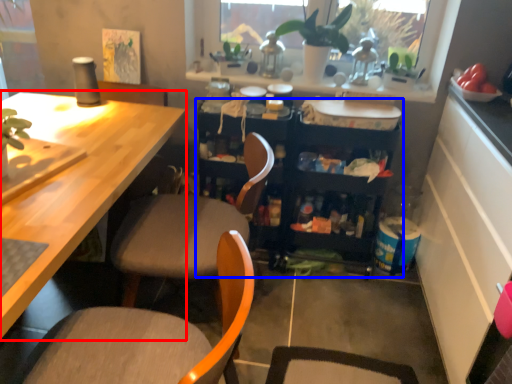
Question: Which object is further to the camera taking this photo, desk (highlighted by a red box) or cabinetry (highlighted by a blue box)?

Choices:
 (A) desk
 (B) cabinetry

Answer: (B)